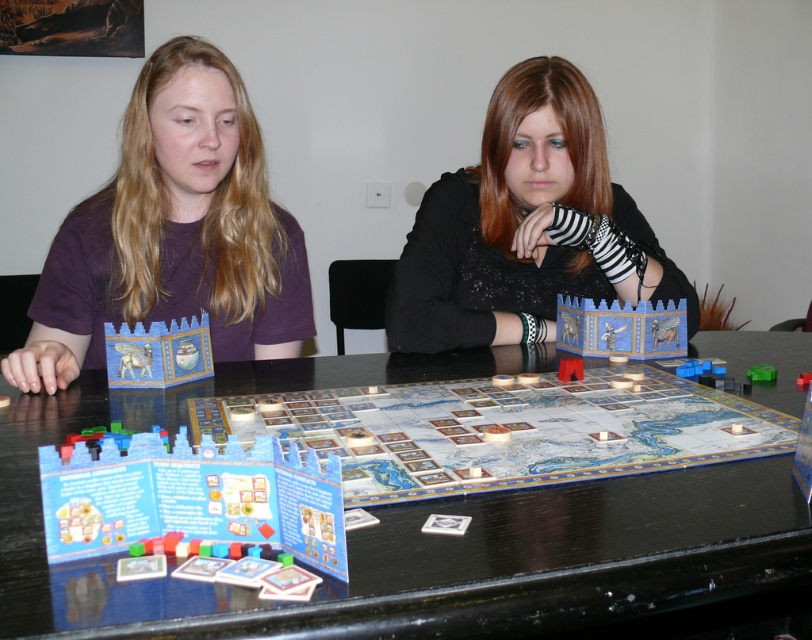
Is wooden board game at center to the left of blue painted wood castle at center from the viewer's perspective?

Correct, you'll find wooden board game at center to the left of blue painted wood castle at center.

Between wooden board game at center and blue painted wood castle at center, which one has more height?

wooden board game at center

Between point (711, 465) and point (572, 336), which one is positioned behind?

Positioned behind is point (572, 336).

Identify the location of wooden board game at center. The width and height of the screenshot is (812, 640). (430, 538).

Is blue painted wood castle at center to the right of blue cardboard castle at center from the viewer's perspective?

Indeed, blue painted wood castle at center is positioned on the right side of blue cardboard castle at center.

Can you confirm if blue painted wood castle at center is taller than blue cardboard castle at center?

Correct, blue painted wood castle at center is much taller as blue cardboard castle at center.

Describe the element at coordinates (620, 328) in the screenshot. The height and width of the screenshot is (640, 812). I see `blue painted wood castle at center` at that location.

Locate an element on the screen. The height and width of the screenshot is (640, 812). blue painted wood castle at center is located at coordinates (620, 328).

Which is behind, point (111, 588) or point (759, 369)?

Positioned behind is point (759, 369).

Is point (184, 605) behind point (771, 374)?

That is False.

Where is `wooden board game at center`? wooden board game at center is located at coordinates click(x=430, y=538).